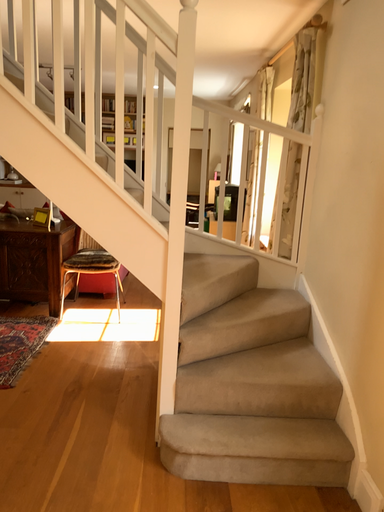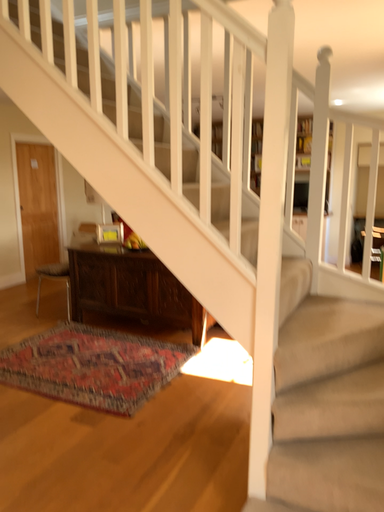
Question: How did the camera likely rotate when shooting the video?

Choices:
 (A) rotated right
 (B) rotated left

Answer: (B)